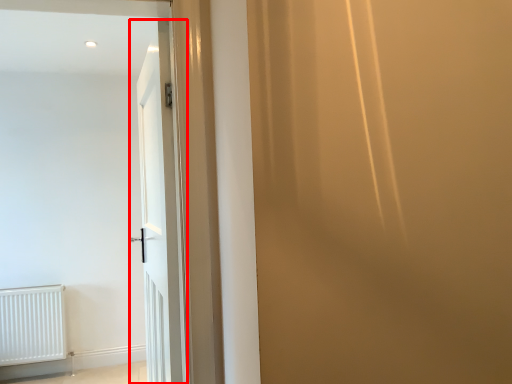
Question: From the image, what is the correct spatial relationship of door (annotated by the red box) in relation to radiator?

Choices:
 (A) right
 (B) left

Answer: (A)